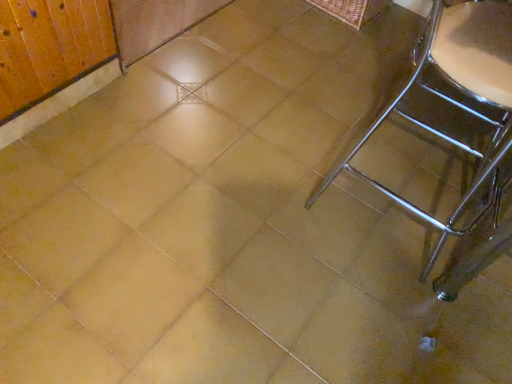
I want to click on vacant region under polished chrome chair at right (from a real-world perspective), so click(366, 189).